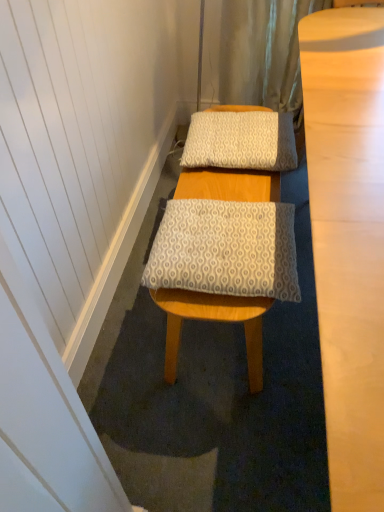
Question: Is patterned fabric pillow at center, acting as the second pillow starting from the back, spatially inside white textured pillow at center, which is the 1th pillow from back to front, or outside of it?

Choices:
 (A) outside
 (B) inside

Answer: (A)

Question: From their relative heights in the image, would you say patterned fabric pillow at center, the first pillow when ordered from front to back, is taller or shorter than white textured pillow at center, which is the 2th pillow from bottom to top?

Choices:
 (A) short
 (B) tall

Answer: (A)

Question: Considering the real-world distances, which object is farthest from the white textured pillow at center, which is the 1th pillow from back to front?

Choices:
 (A) white textured bath mat at center
 (B) patterned fabric pillow at center, acting as the second pillow starting from the back

Answer: (A)

Question: Which object is positioned farthest from the patterned fabric pillow at center, marked as the 1th pillow in a bottom-to-top arrangement?

Choices:
 (A) white textured pillow at center, which is the 2th pillow from bottom to top
 (B) white textured bath mat at center

Answer: (B)